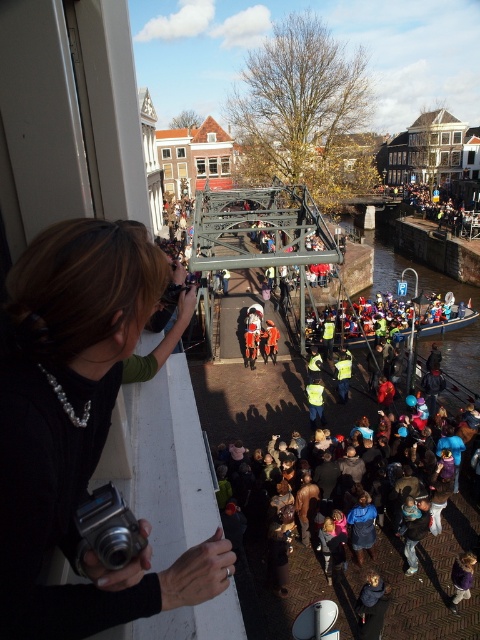
Question: Does black fabric camera at left appear under silver metallic camera at lower left?

Choices:
 (A) yes
 (B) no

Answer: (A)

Question: Which point is closer to the camera taking this photo?

Choices:
 (A) (149, 604)
 (B) (132, 557)

Answer: (A)

Question: Is black fabric camera at left thinner than silver metallic camera at lower left?

Choices:
 (A) yes
 (B) no

Answer: (A)

Question: Does black fabric camera at left have a greater width compared to silver metallic camera at lower left?

Choices:
 (A) yes
 (B) no

Answer: (B)